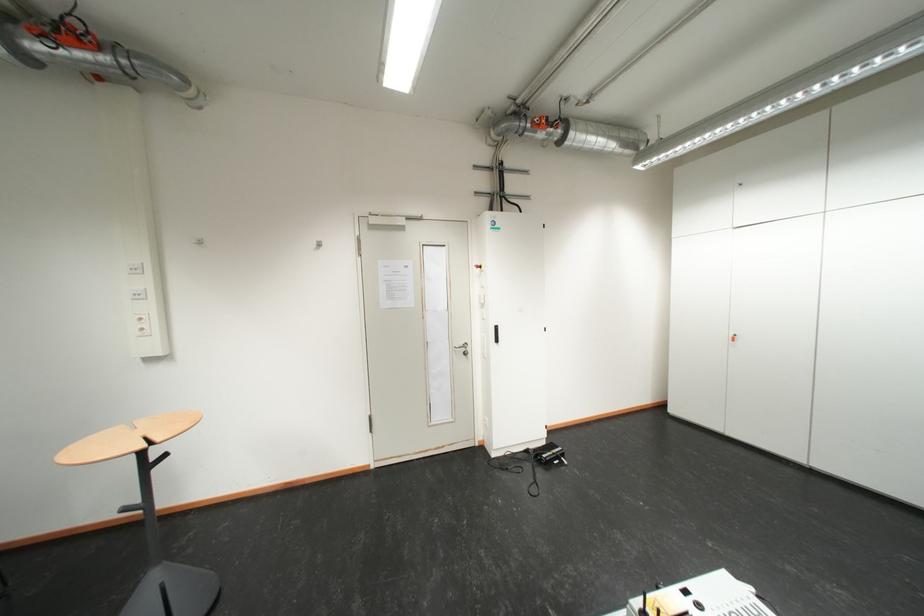
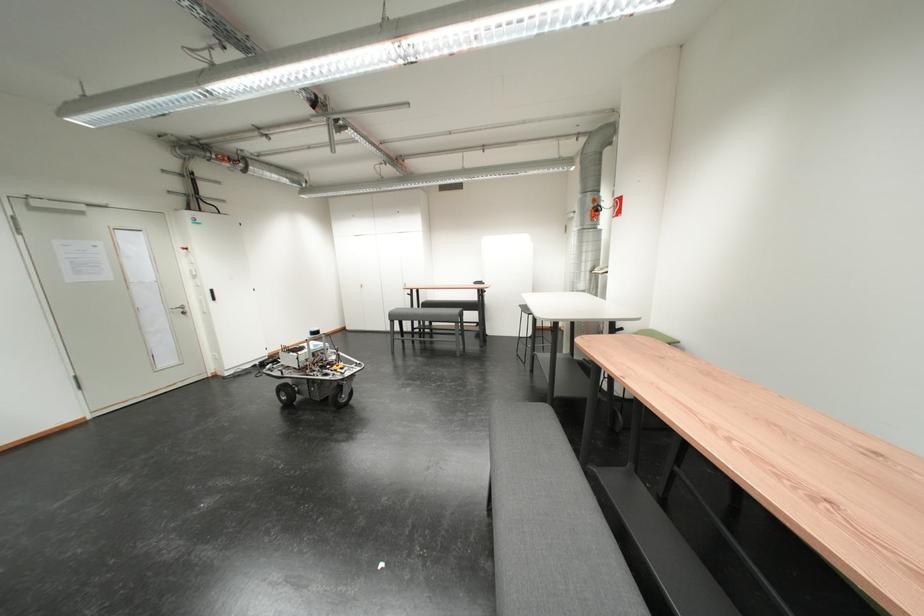
The point at [466,353] is marked in the first image. Where is the corresponding point in the second image?

(184, 314)